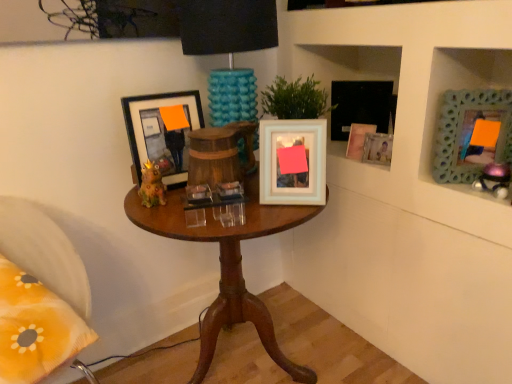
Question: Are yellow fabric pillow at lower left and metallic purple toy at upper right, the second toy viewed from the left, located far from each other?

Choices:
 (A) yes
 (B) no

Answer: (A)

Question: Considering the relative positions of yellow fabric pillow at lower left and metallic purple toy at upper right, the second toy viewed from the left, in the image provided, is yellow fabric pillow at lower left behind metallic purple toy at upper right, the second toy viewed from the left,?

Choices:
 (A) yes
 (B) no

Answer: (B)

Question: Is yellow fabric pillow at lower left oriented away from metallic purple toy at upper right, placed as the first toy when sorted from right to left?

Choices:
 (A) no
 (B) yes

Answer: (A)

Question: From a real-world perspective, does yellow fabric pillow at lower left stand above metallic purple toy at upper right, the second toy viewed from the left?

Choices:
 (A) no
 (B) yes

Answer: (A)

Question: Does yellow fabric pillow at lower left appear on the left side of metallic purple toy at upper right, placed as the first toy when sorted from right to left?

Choices:
 (A) yes
 (B) no

Answer: (A)

Question: Is white textured cabinet at upper right in front of or behind wooden table at center in the image?

Choices:
 (A) behind
 (B) front

Answer: (B)

Question: From their relative heights in the image, would you say white textured cabinet at upper right is taller or shorter than wooden table at center?

Choices:
 (A) short
 (B) tall

Answer: (B)

Question: In the image, is white textured cabinet at upper right on the left side or the right side of wooden table at center?

Choices:
 (A) left
 (B) right

Answer: (B)

Question: From a real-world perspective, is white textured cabinet at upper right above or below wooden table at center?

Choices:
 (A) below
 (B) above

Answer: (B)

Question: From the image's perspective, is yellow fabric pillow at lower left located above or below white glossy picture frame at center, positioned as the second picture frame in left-to-right order?

Choices:
 (A) above
 (B) below

Answer: (B)

Question: Is yellow fabric pillow at lower left wider or thinner than white glossy picture frame at center, positioned as the second picture frame in left-to-right order?

Choices:
 (A) wide
 (B) thin

Answer: (A)

Question: Visually, is yellow fabric pillow at lower left positioned to the left or to the right of white glossy picture frame at center, positioned as the second picture frame in left-to-right order?

Choices:
 (A) right
 (B) left

Answer: (B)

Question: Does point (53, 362) appear closer or farther from the camera than point (269, 127)?

Choices:
 (A) farther
 (B) closer

Answer: (B)

Question: From the image's perspective, is green textured frame at upper right, the 1th picture frame when ordered from right to left, positioned above or below matte ceramic frog at center, arranged as the 2th toy when viewed from the right?

Choices:
 (A) below
 (B) above

Answer: (B)

Question: Visually, is green textured frame at upper right, the 1th picture frame when ordered from right to left, positioned to the left or to the right of matte ceramic frog at center, the first toy in the left-to-right sequence?

Choices:
 (A) right
 (B) left

Answer: (A)